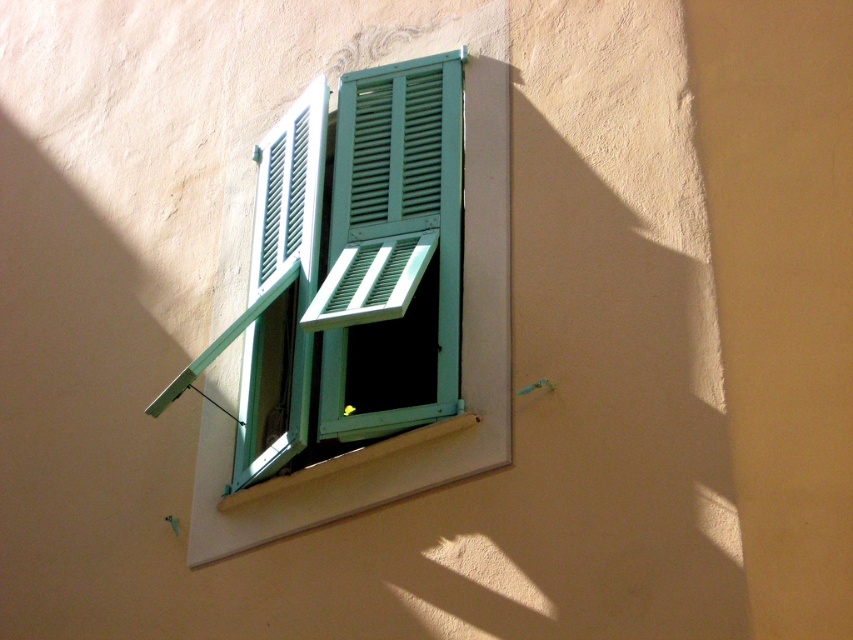
Is teal painted wood at center to the left of white painted wood at lower center from the viewer's perspective?

Incorrect, teal painted wood at center is not on the left side of white painted wood at lower center.

Does teal painted wood at center appear under white painted wood at lower center?

No.

Does point (233, 385) come behind point (287, 484)?

Yes, it is behind point (287, 484).

Image resolution: width=853 pixels, height=640 pixels. In order to click on teal painted wood at center in this screenshot , I will do `click(461, 358)`.